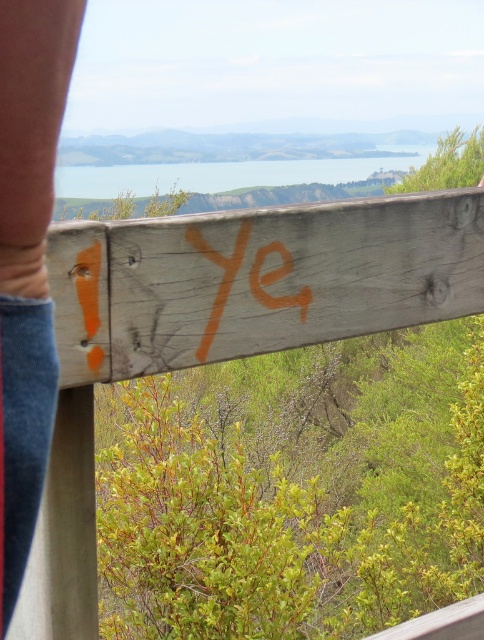
Is smooth skin arm at upper left taller than orange painted lettering at center?

Yes.

Is point (39, 186) closer to camera compared to point (231, 253)?

Yes, point (39, 186) is in front of point (231, 253).

In order to click on smooth skin arm at upper left in this screenshot , I will do `click(28, 260)`.